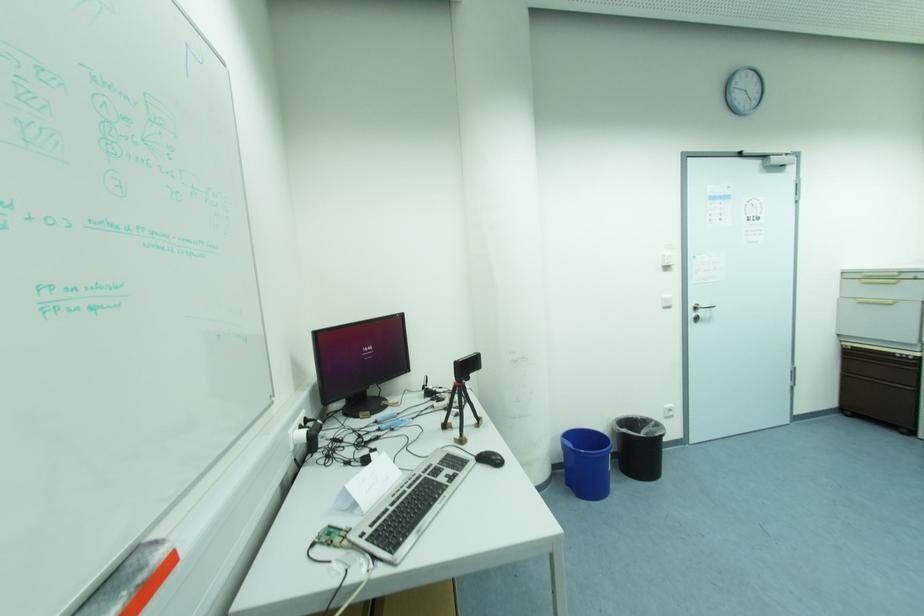
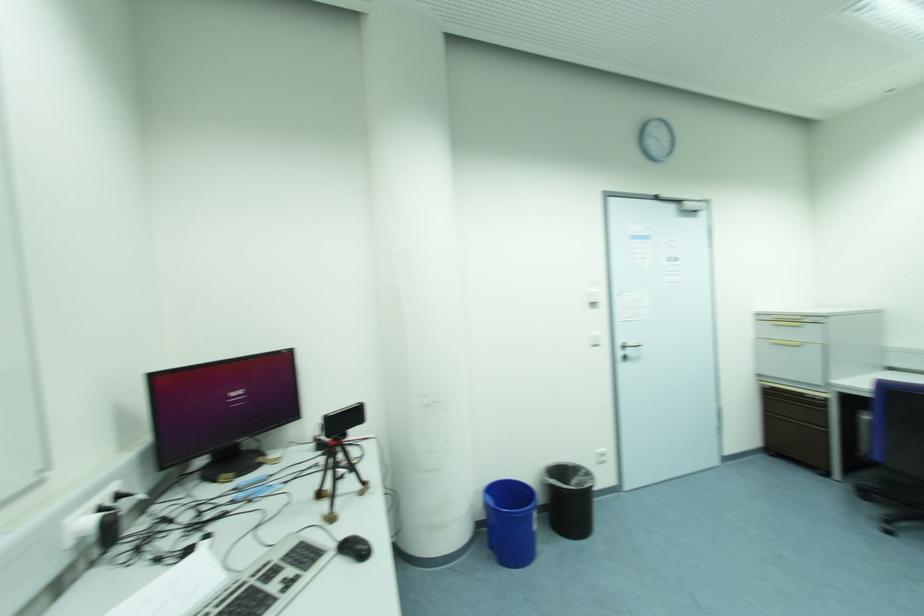
Which direction would the cameraman need to move to produce the second image?

The cameraman walked toward right, forward.